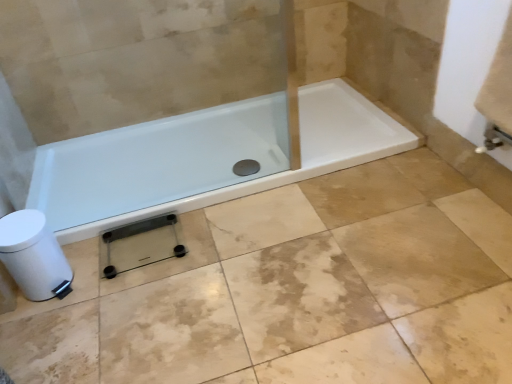
This screenshot has height=384, width=512. In order to click on free space in front of transparent glass scale at center in this screenshot , I will do `click(136, 304)`.